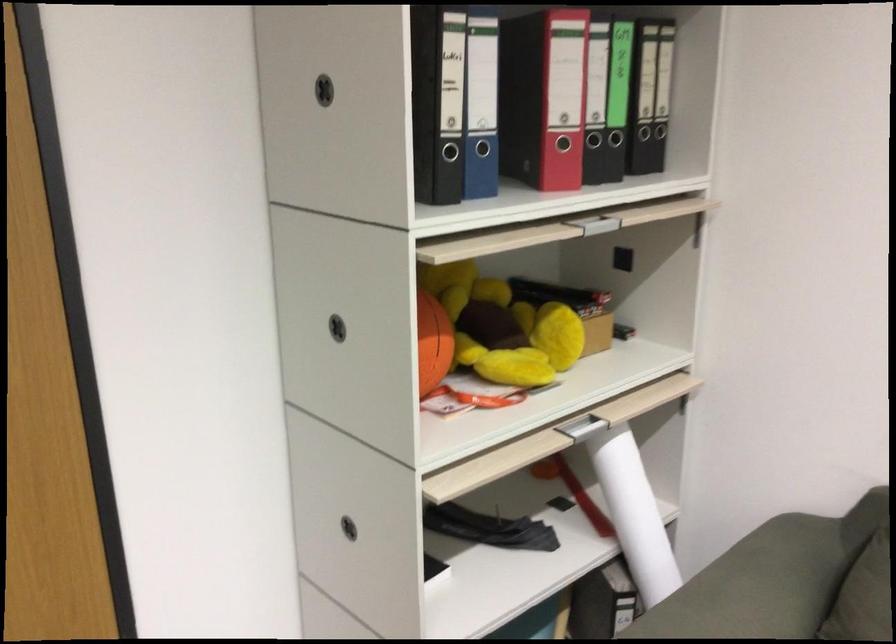
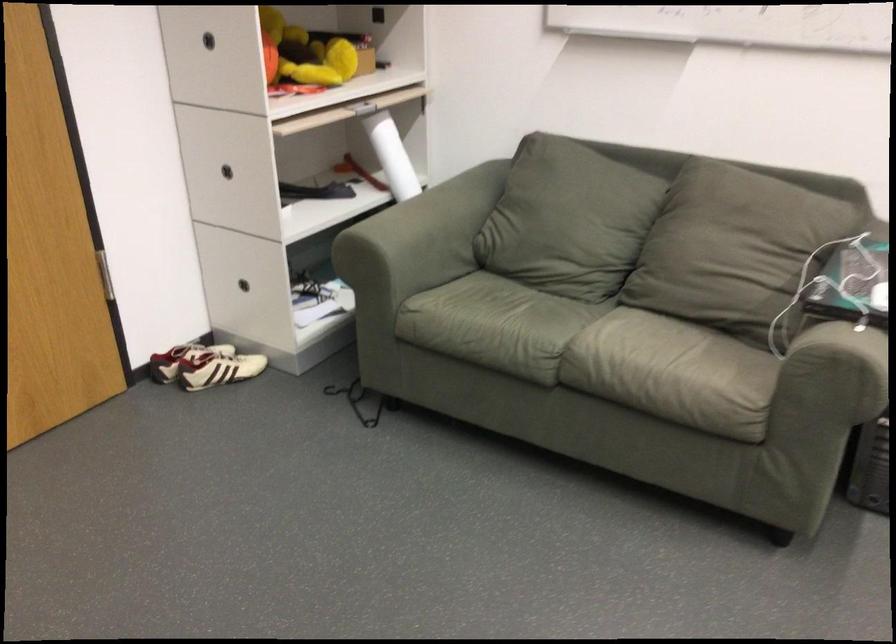
The point at (347, 514) is marked in the first image. Where is the corresponding point in the second image?

(227, 171)